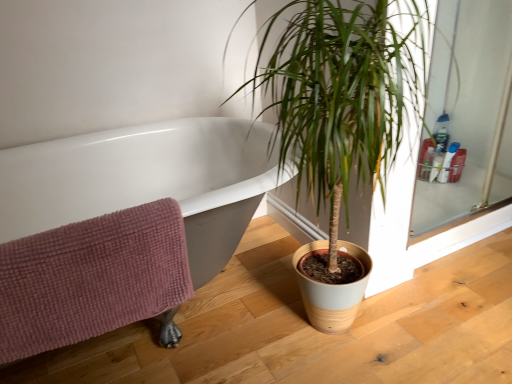
Question: Should I look upward or downward to see green leafy plant at center?

Choices:
 (A) up
 (B) down

Answer: (A)

Question: Considering the relative sizes of pink waffle-textured towel at lower left and green leafy plant at center in the image provided, is pink waffle-textured towel at lower left shorter than green leafy plant at center?

Choices:
 (A) yes
 (B) no

Answer: (A)

Question: Can you confirm if pink waffle-textured towel at lower left is positioned to the right of green leafy plant at center?

Choices:
 (A) no
 (B) yes

Answer: (A)

Question: Does pink waffle-textured towel at lower left have a smaller size compared to green leafy plant at center?

Choices:
 (A) yes
 (B) no

Answer: (A)

Question: Is pink waffle-textured towel at lower left closer to camera compared to green leafy plant at center?

Choices:
 (A) yes
 (B) no

Answer: (B)

Question: From a real-world perspective, is pink waffle-textured towel at lower left below green leafy plant at center?

Choices:
 (A) no
 (B) yes

Answer: (B)

Question: Is pink waffle-textured towel at lower left far from green leafy plant at center?

Choices:
 (A) no
 (B) yes

Answer: (A)

Question: Is translucent plastic bottles at upper right, arranged as the 1th toiletry when viewed from the left, surrounding green leafy plant at center?

Choices:
 (A) no
 (B) yes

Answer: (A)

Question: Is translucent plastic bottles at upper right, arranged as the 1th toiletry when viewed from the left, not within green leafy plant at center?

Choices:
 (A) no
 (B) yes

Answer: (B)

Question: Considering the relative positions of translucent plastic bottles at upper right, arranged as the 1th toiletry when viewed from the left, and green leafy plant at center in the image provided, is translucent plastic bottles at upper right, arranged as the 1th toiletry when viewed from the left, to the right of green leafy plant at center from the viewer's perspective?

Choices:
 (A) no
 (B) yes

Answer: (B)

Question: Is translucent plastic bottles at upper right, acting as the third toiletry starting from the right, in front of green leafy plant at center?

Choices:
 (A) no
 (B) yes

Answer: (A)

Question: Can you confirm if translucent plastic bottles at upper right, acting as the third toiletry starting from the right, is taller than green leafy plant at center?

Choices:
 (A) yes
 (B) no

Answer: (B)

Question: Is translucent plastic bottles at upper right, acting as the third toiletry starting from the right, thinner than green leafy plant at center?

Choices:
 (A) no
 (B) yes

Answer: (B)

Question: Does green leafy plant at center appear on the left side of translucent plastic bottles at upper right, positioned as the second toiletry in left-to-right order?

Choices:
 (A) no
 (B) yes

Answer: (B)